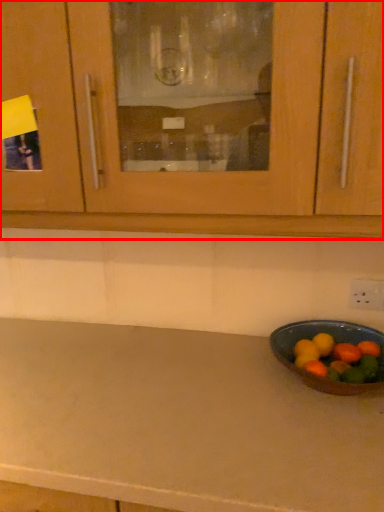
Question: From the image's perspective, where is cabinetry (annotated by the red box) located relative to fruit?

Choices:
 (A) below
 (B) above

Answer: (B)